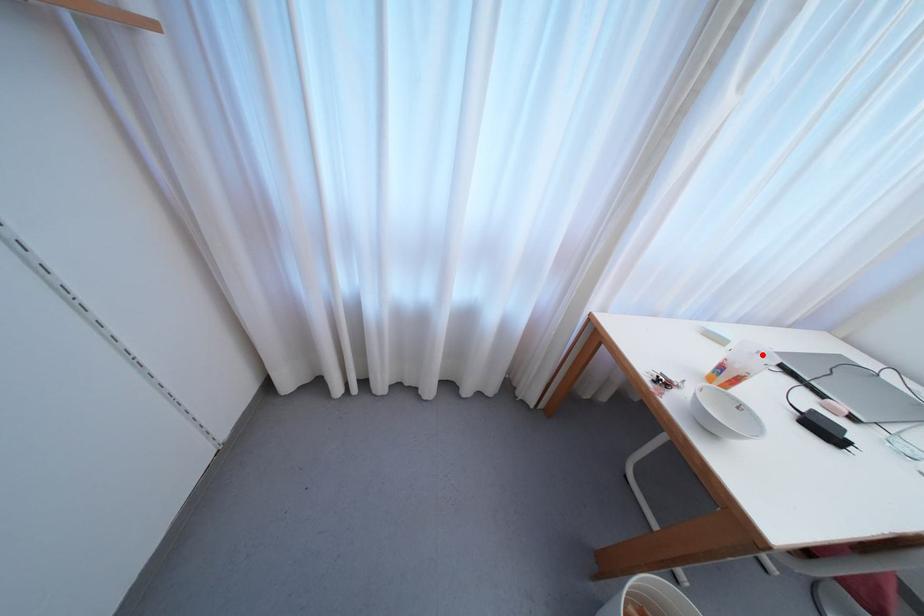
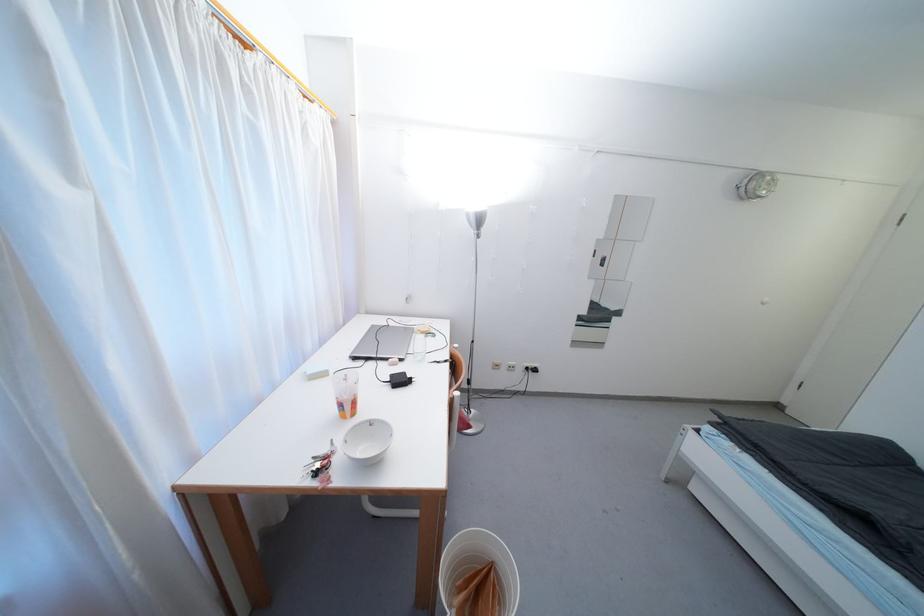
Find the pixel in the second image that matches the highlighted location in the first image.

(349, 378)